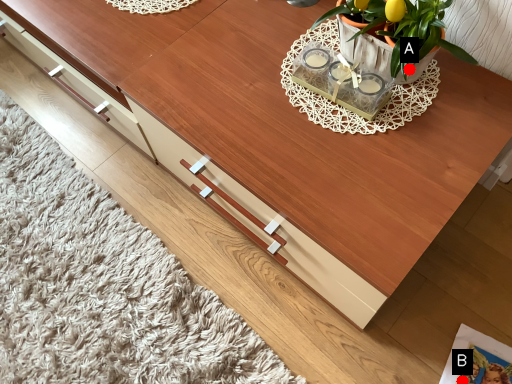
Question: Two points are circled on the image, labeled by A and B beside each circle. Among these points, which one is nearest to the camera?

Choices:
 (A) A is closer
 (B) B is closer

Answer: (A)